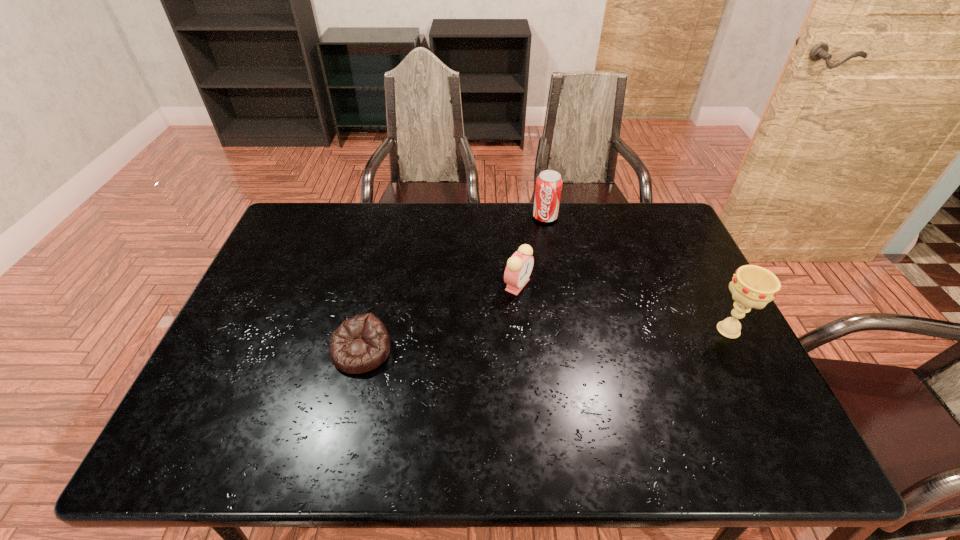
You are a GUI agent. You are given a task and a screenshot of the screen. Output one action in this format:
    pyautogui.click(x=<x>, y=<y>)
    Task: Click on the leftmost object
    
    Given the screenshot: What is the action you would take?
    pyautogui.click(x=360, y=344)

Where is `beanbag`? The height and width of the screenshot is (540, 960). beanbag is located at coordinates (360, 344).

I want to click on chalice, so click(752, 286).

Image resolution: width=960 pixels, height=540 pixels. I want to click on the third tallest object, so click(x=519, y=266).

Find the location of `alarm clock`. alarm clock is located at coordinates (519, 266).

Find the location of a particular element. This screenshot has height=540, width=960. soda can is located at coordinates tap(549, 183).

At what (x,y) coordinates should I click in order to perform the action: click on the farthest object. Please return your answer as a coordinate pair (x, y). This screenshot has width=960, height=540. Looking at the image, I should click on (549, 183).

Find the location of a particular element. blank area located 0.190m on the back of the leftmost object is located at coordinates (379, 279).

Locate an element on the screen. This screenshot has height=540, width=960. vacant region located 0.060m on the back of the chalice is located at coordinates (712, 300).

In order to click on vacant space positioned 0.250m on the face of the third tallest object in this screenshot , I will do `click(561, 368)`.